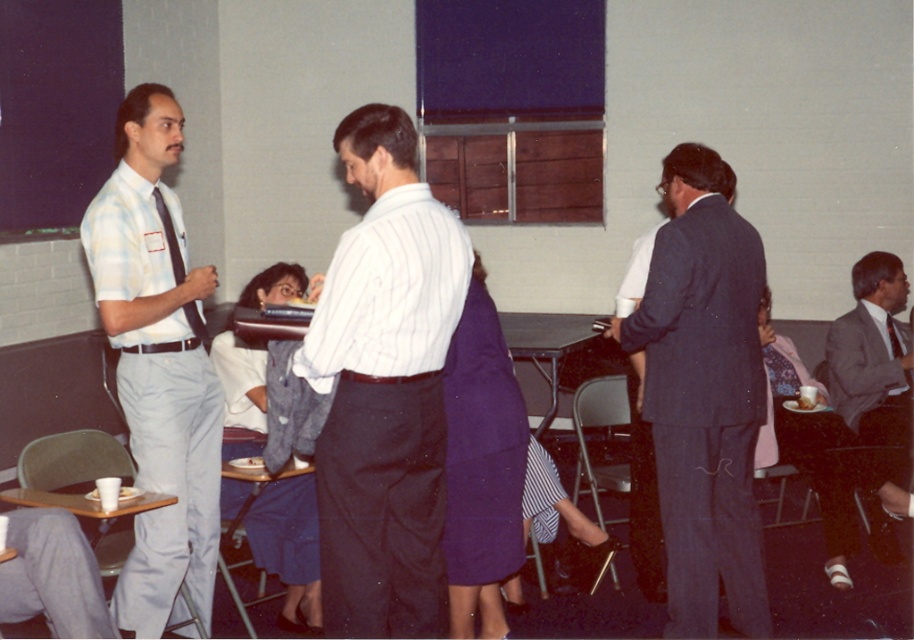
Between white fabric dress at center and gray suit jacket at lower right, which one appears on the left side from the viewer's perspective?

white fabric dress at center

Which is more to the right, white fabric dress at center or gray suit jacket at lower right?

gray suit jacket at lower right

The width and height of the screenshot is (914, 640). Identify the location of white fabric dress at center. (288, 547).

You are a GUI agent. You are given a task and a screenshot of the screen. Output one action in this format:
    pyautogui.click(x=<x>, y=<y>)
    Task: Click on the white fabric dress at center
    Image resolution: width=914 pixels, height=640 pixels.
    Given the screenshot: What is the action you would take?
    pyautogui.click(x=288, y=547)

Does light blue plaid shirt at left have a lesser width compared to white fabric dress at center?

Indeed, light blue plaid shirt at left has a lesser width compared to white fabric dress at center.

How far apart are light blue plaid shirt at left and white fabric dress at center?

A distance of 20.18 inches exists between light blue plaid shirt at left and white fabric dress at center.

Who is more forward, (220, 419) or (310, 572)?

Point (220, 419) is in front.

Where is `light blue plaid shirt at left`? This screenshot has height=640, width=914. light blue plaid shirt at left is located at coordinates (157, 364).

Does light blue plaid shirt at left appear under gray suit jacket at lower right?

No.

Does light blue plaid shirt at left come in front of gray suit jacket at lower right?

That is True.

Is point (197, 518) behind point (843, 355)?

That is False.

Identify the location of light blue plaid shirt at left. This screenshot has width=914, height=640. (157, 364).